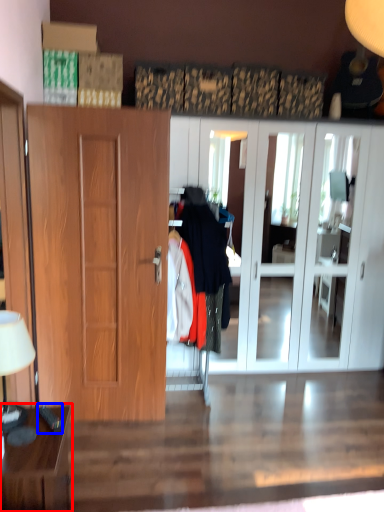
Question: Among these objects, which one is farthest to the camera, table (highlighted by a red box) or remote control (highlighted by a blue box)?

Choices:
 (A) table
 (B) remote control

Answer: (B)